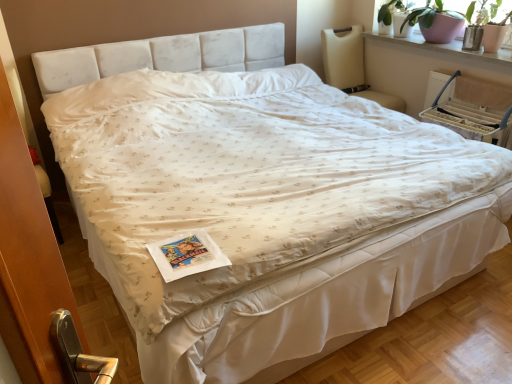
Question: Does beige fabric rocking chair at upper right appear on the right side of smooth white window sill at upper right?

Choices:
 (A) yes
 (B) no

Answer: (B)

Question: Does beige fabric rocking chair at upper right have a smaller size compared to smooth white window sill at upper right?

Choices:
 (A) yes
 (B) no

Answer: (B)

Question: From the image's perspective, is beige fabric rocking chair at upper right beneath smooth white window sill at upper right?

Choices:
 (A) yes
 (B) no

Answer: (A)

Question: Could smooth white window sill at upper right be considered to be inside beige fabric rocking chair at upper right?

Choices:
 (A) yes
 (B) no

Answer: (B)

Question: Is beige fabric rocking chair at upper right at the left side of smooth white window sill at upper right?

Choices:
 (A) yes
 (B) no

Answer: (A)

Question: Is beige fabric rocking chair at upper right aimed at smooth white window sill at upper right?

Choices:
 (A) yes
 (B) no

Answer: (B)

Question: Can you confirm if beige fabric rocking chair at upper right is taller than beige fabric armchair at upper right?

Choices:
 (A) no
 (B) yes

Answer: (B)

Question: Does beige fabric rocking chair at upper right have a lesser height compared to beige fabric armchair at upper right?

Choices:
 (A) yes
 (B) no

Answer: (B)

Question: Is beige fabric rocking chair at upper right placed right next to beige fabric armchair at upper right?

Choices:
 (A) no
 (B) yes

Answer: (A)

Question: From the image's perspective, is beige fabric rocking chair at upper right located beneath beige fabric armchair at upper right?

Choices:
 (A) yes
 (B) no

Answer: (B)

Question: Is beige fabric rocking chair at upper right not close to beige fabric armchair at upper right?

Choices:
 (A) no
 (B) yes

Answer: (A)

Question: Is beige fabric rocking chair at upper right positioned with its back to beige fabric armchair at upper right?

Choices:
 (A) yes
 (B) no

Answer: (B)

Question: Is beige fabric armchair at upper right positioned beyond the bounds of beige fabric rocking chair at upper right?

Choices:
 (A) yes
 (B) no

Answer: (A)